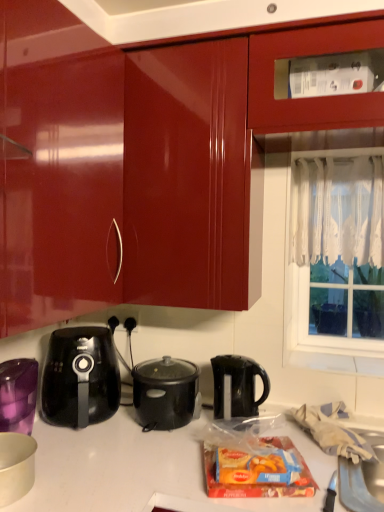
Question: Is black plastic kettle at center, the 1th kettle in the right-to-left sequence, to the left or to the right of black plastic outlet at center in the image?

Choices:
 (A) left
 (B) right

Answer: (B)

Question: Do you think black plastic kettle at center, which is counted as the second kettle, starting from the left, is within black plastic outlet at center, or outside of it?

Choices:
 (A) outside
 (B) inside

Answer: (A)

Question: Estimate the real-world distances between objects in this image. Which object is farther from the matte plastic cereal at lower center?

Choices:
 (A) black plastic slow cooker at center, which is the 2th kitchen appliance in front-to-back order
 (B) glossy wood cabinet at upper center
 (C) black plastic kettle at center, the 1th kettle in the right-to-left sequence
 (D) black plastic kettle at lower left, the second kettle positioned from the right
 (E) white matte bowl at lower left, the 1th kitchen appliance viewed from the left

Answer: (B)

Question: Which of these objects is positioned farthest from the white lace curtain at window right?

Choices:
 (A) white matte bowl at lower left, placed as the second kitchen appliance when sorted from right to left
 (B) black plastic outlet at center
 (C) black plastic slow cooker at center, placed as the first kitchen appliance when sorted from right to left
 (D) matte plastic cereal at lower center
 (E) glossy wood cabinet at upper center

Answer: (A)